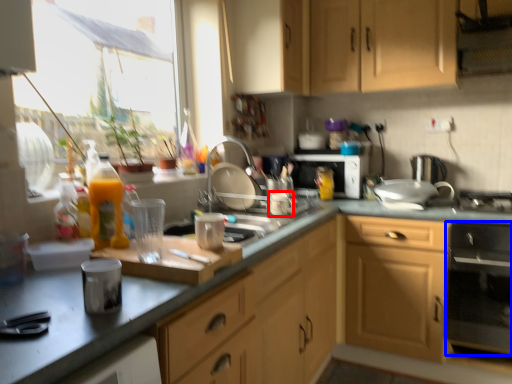
Question: Which object is further to the camera taking this photo, appliance (highlighted by a red box) or kitchen appliance (highlighted by a blue box)?

Choices:
 (A) appliance
 (B) kitchen appliance

Answer: (A)